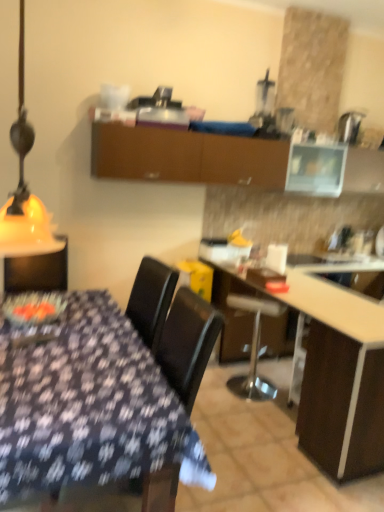
Question: Could you tell me if yellow matte lampshade at left is turned towards metallic silver bar stool at center?

Choices:
 (A) no
 (B) yes

Answer: (A)

Question: From a real-world perspective, is yellow matte lampshade at left physically above metallic silver bar stool at center?

Choices:
 (A) no
 (B) yes

Answer: (B)

Question: Does yellow matte lampshade at left have a lesser width compared to metallic silver bar stool at center?

Choices:
 (A) yes
 (B) no

Answer: (A)

Question: From the image's perspective, would you say yellow matte lampshade at left is shown under metallic silver bar stool at center?

Choices:
 (A) yes
 (B) no

Answer: (B)

Question: From a real-world perspective, is yellow matte lampshade at left located beneath metallic silver bar stool at center?

Choices:
 (A) yes
 (B) no

Answer: (B)

Question: Considering the positions of white glossy countertop at center and wooden table at center in the image, is white glossy countertop at center wider or thinner than wooden table at center?

Choices:
 (A) thin
 (B) wide

Answer: (A)

Question: In the image, is white glossy countertop at center positioned in front of or behind wooden table at center?

Choices:
 (A) front
 (B) behind

Answer: (B)

Question: Is point (380, 311) closer or farther from the camera than point (307, 408)?

Choices:
 (A) closer
 (B) farther

Answer: (A)

Question: Choose the correct answer: Is white glossy countertop at center inside wooden table at center or outside it?

Choices:
 (A) outside
 (B) inside

Answer: (B)

Question: From a real-world perspective, relative to wooden table at center, is yellow matte lampshade at left vertically above or below?

Choices:
 (A) below
 (B) above

Answer: (B)

Question: Considering the positions of yellow matte lampshade at left and wooden table at center in the image, is yellow matte lampshade at left bigger or smaller than wooden table at center?

Choices:
 (A) big
 (B) small

Answer: (B)

Question: Is yellow matte lampshade at left wider or thinner than wooden table at center?

Choices:
 (A) thin
 (B) wide

Answer: (A)

Question: Visually, is yellow matte lampshade at left positioned to the left or to the right of wooden table at center?

Choices:
 (A) right
 (B) left

Answer: (B)

Question: Considering the positions of yellow matte lampshade at left and metallic silver bar stool at center in the image, is yellow matte lampshade at left wider or thinner than metallic silver bar stool at center?

Choices:
 (A) thin
 (B) wide

Answer: (A)

Question: Is point click(x=8, y=249) positioned closer to the camera than point click(x=244, y=395)?

Choices:
 (A) farther
 (B) closer

Answer: (B)